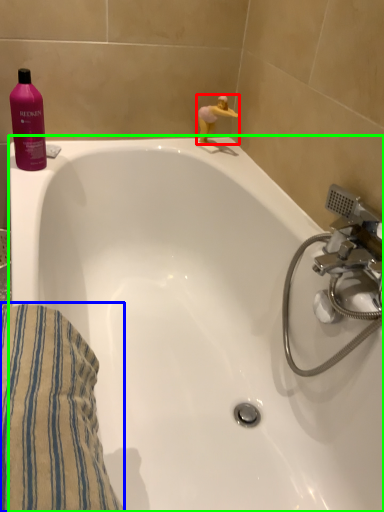
Question: Based on their relative distances, which object is farther from miniature (highlighted by a red box)? Choose from bath towel (highlighted by a blue box) and bathtub (highlighted by a green box).

Choices:
 (A) bath towel
 (B) bathtub

Answer: (A)